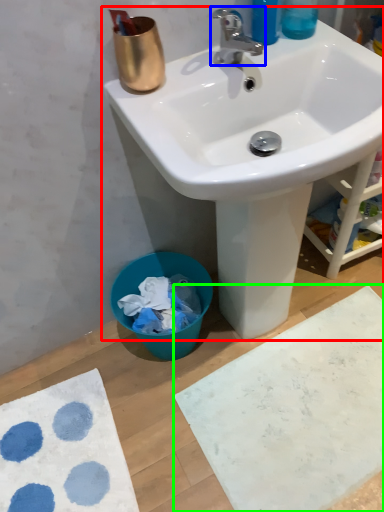
Question: Considering the real-world distances, which object is closest to sink (highlighted by a red box)? tap (highlighted by a blue box) or bath mat (highlighted by a green box).

Choices:
 (A) tap
 (B) bath mat

Answer: (A)